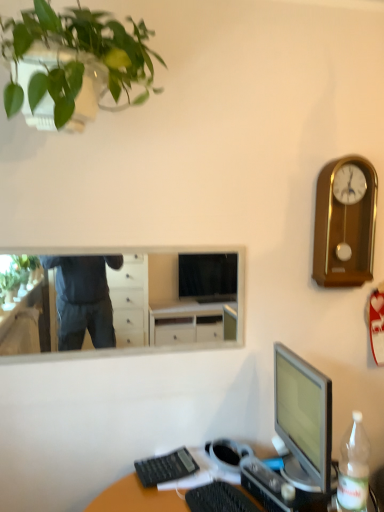
Question: Does clear plastic bottle at lower right have a greater height compared to green matte plant at upper left?

Choices:
 (A) yes
 (B) no

Answer: (B)

Question: From the image's perspective, is clear plastic bottle at lower right located beneath green matte plant at upper left?

Choices:
 (A) yes
 (B) no

Answer: (A)

Question: From the image's perspective, is clear plastic bottle at lower right on green matte plant at upper left?

Choices:
 (A) yes
 (B) no

Answer: (B)

Question: Is clear plastic bottle at lower right positioned behind green matte plant at upper left?

Choices:
 (A) no
 (B) yes

Answer: (B)

Question: Is clear plastic bottle at lower right positioned before green matte plant at upper left?

Choices:
 (A) yes
 (B) no

Answer: (B)

Question: From a real-world perspective, does clear plastic bottle at lower right stand above green matte plant at upper left?

Choices:
 (A) yes
 (B) no

Answer: (B)

Question: Could you tell me if white glossy mirror at upper center is facing black plastic keyboard at lower center, the second computer keyboard from the left?

Choices:
 (A) yes
 (B) no

Answer: (B)

Question: Is white glossy mirror at upper center looking in the opposite direction of black plastic keyboard at lower center, the second computer keyboard from the left?

Choices:
 (A) no
 (B) yes

Answer: (A)

Question: Considering the relative positions of white glossy mirror at upper center and black plastic keyboard at lower center, the second computer keyboard from the left, in the image provided, is white glossy mirror at upper center to the right of black plastic keyboard at lower center, the second computer keyboard from the left, from the viewer's perspective?

Choices:
 (A) yes
 (B) no

Answer: (B)

Question: Can you confirm if white glossy mirror at upper center is shorter than black plastic keyboard at lower center, the second computer keyboard from the left?

Choices:
 (A) yes
 (B) no

Answer: (B)

Question: Can you confirm if white glossy mirror at upper center is positioned to the left of black plastic keyboard at lower center, positioned as the 1th computer keyboard in front-to-back order?

Choices:
 (A) yes
 (B) no

Answer: (A)

Question: Would you say black plastic keyboard at lower center, which appears as the second computer keyboard when viewed from the back, is part of white glossy mirror at upper center's contents?

Choices:
 (A) no
 (B) yes

Answer: (A)

Question: From a real-world perspective, is black plastic keyboard at lower center, which is the 2th computer keyboard from front to back, on black plastic keyboard at lower center, positioned as the 1th computer keyboard in front-to-back order?

Choices:
 (A) yes
 (B) no

Answer: (A)